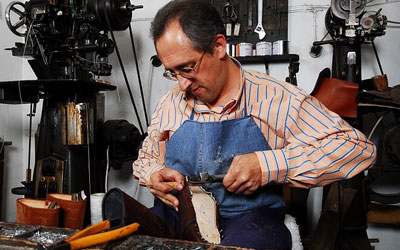
Where is `stains`? The height and width of the screenshot is (250, 400). stains is located at coordinates (243, 51).